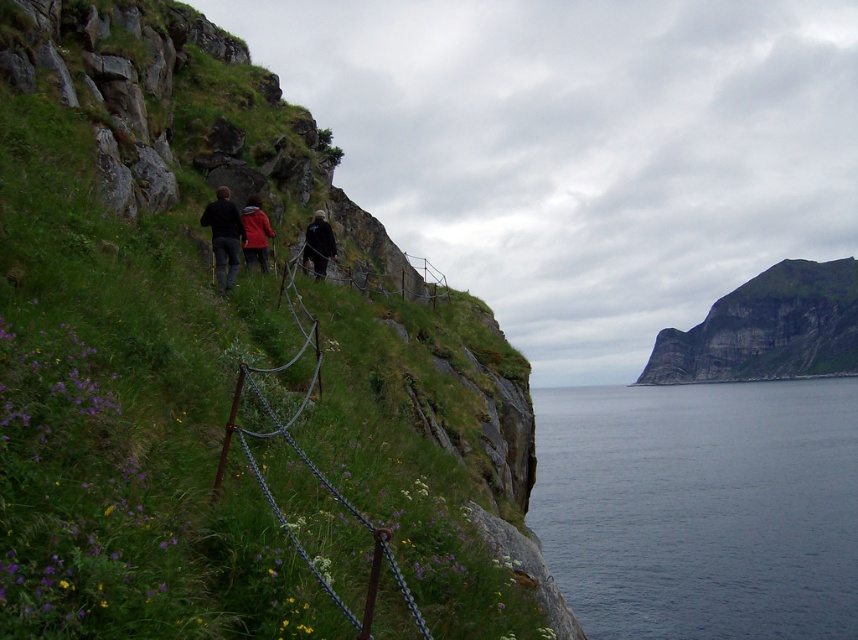
Does blue water at lower right have a greater width compared to dark blue jacket at center?

Yes, blue water at lower right is wider than dark blue jacket at center.

Which is more to the left, blue water at lower right or dark blue jacket at center?

From the viewer's perspective, dark blue jacket at center appears more on the left side.

Which is behind, point (612, 420) or point (307, 248)?

The point (612, 420) is behind.

Where is `blue water at lower right`? The width and height of the screenshot is (858, 640). blue water at lower right is located at coordinates (701, 508).

Which is more to the left, rugged rock cliff at upper right or rusty chain-link fence at upper left?

Positioned to the left is rusty chain-link fence at upper left.

Looking at this image, is rugged rock cliff at upper right above rusty chain-link fence at upper left?

Actually, rugged rock cliff at upper right is below rusty chain-link fence at upper left.

I want to click on rugged rock cliff at upper right, so click(x=766, y=328).

Where is `rugged rock cliff at upper right`? rugged rock cliff at upper right is located at coordinates (766, 328).

Between blue water at lower right and dark blue jeans at center, which one has less height?

Standing shorter between the two is dark blue jeans at center.

Which of these two, blue water at lower right or dark blue jeans at center, stands taller?

With more height is blue water at lower right.

Between point (710, 550) and point (216, 266), which one is positioned in front?

Point (216, 266) is in front.

You are a GUI agent. You are given a task and a screenshot of the screen. Output one action in this format:
    pyautogui.click(x=<x>, y=<y>)
    Task: Click on the blue water at lower right
    
    Given the screenshot: What is the action you would take?
    pyautogui.click(x=701, y=508)